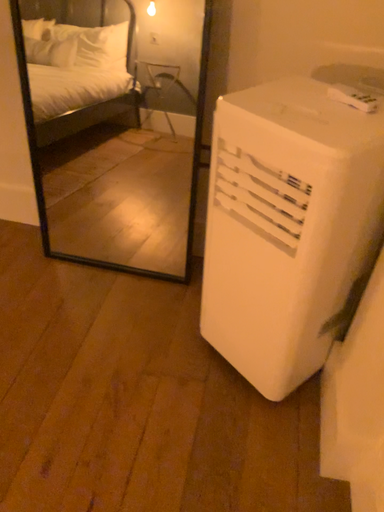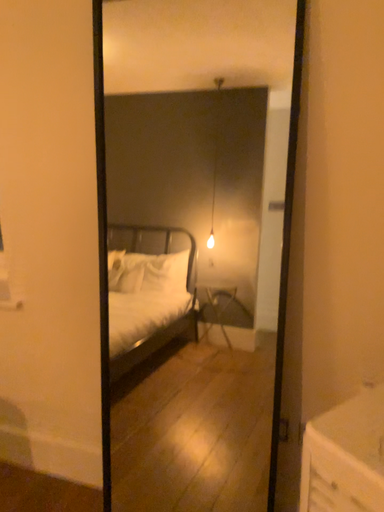
Question: Which way did the camera rotate in the video?

Choices:
 (A) rotated downward
 (B) rotated upward

Answer: (B)